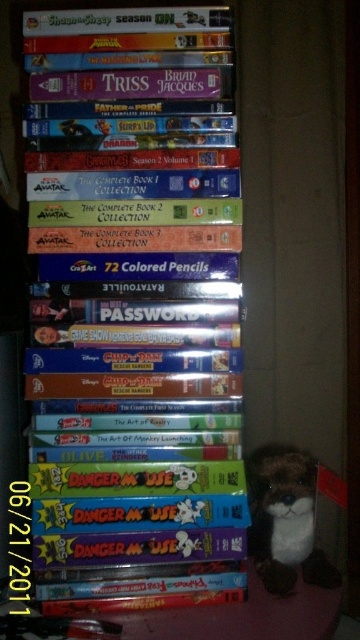
Who is taller, hardcover book at center or brown plush toy at lower right?

hardcover book at center

Does hardcover book at center appear on the right side of brown plush toy at lower right?

Incorrect, hardcover book at center is not on the right side of brown plush toy at lower right.

Who is more forward, (x=195, y=380) or (x=257, y=547)?

Point (x=195, y=380) is in front.

At what (x,y) coordinates should I click in order to perform the action: click on hardcover book at center. Please return your answer as a coordinate pair (x, y). Looking at the image, I should click on (135, 308).